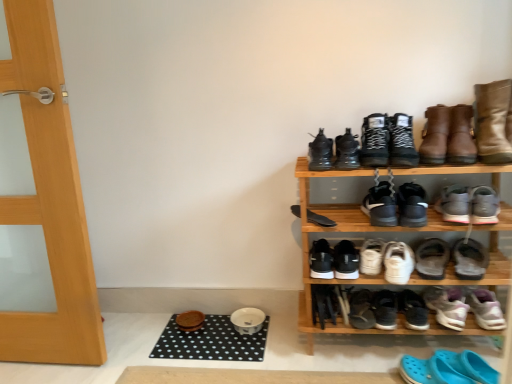
You are a GUI agent. You are given a task and a screenshot of the screen. Output one action in this format:
    pyautogui.click(x=<x>, y=<y>)
    Task: Click on the free space between wooden shoe rack at upper right and black rubber doormat at lower center, which is the 2th doormat from back to front
    Image resolution: width=512 pixels, height=384 pixels.
    Given the screenshot: What is the action you would take?
    pyautogui.click(x=240, y=340)